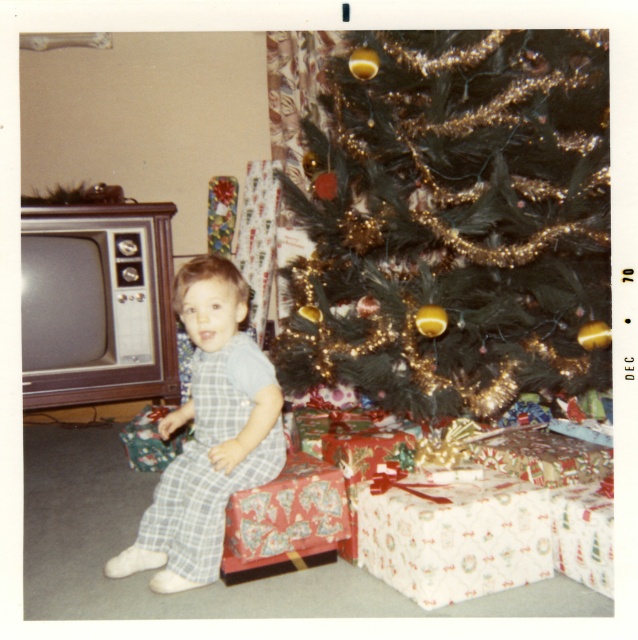
You are standing in front of a Christmas tree with a wrapped present at point (x=537, y=44). You want to place a new gift that is 2 meters long under the tree. Will the space be sufficient?

The distance between you and the point (x=537, y=44) is 1.54 meters. Since the new gift is 2 meters long, which is longer than the available space, it won t fit.